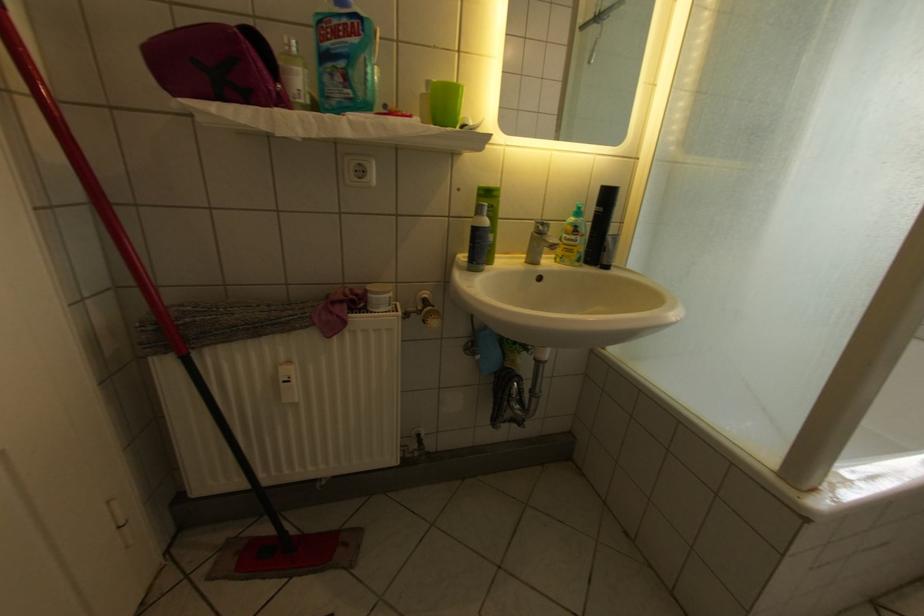
At what (x,y) coordinates should I click in order to perform the action: click on radiator thermostat knob. Please return your answer as a coordinate pair (x, y). This screenshot has width=924, height=616. Looking at the image, I should click on (431, 317).